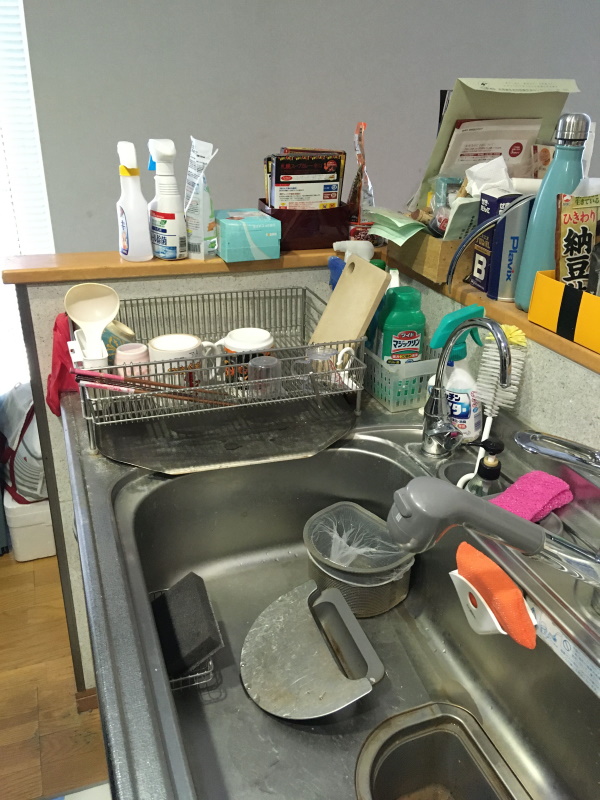
Find the location of a particular element. small cutting board is located at coordinates (355, 296).